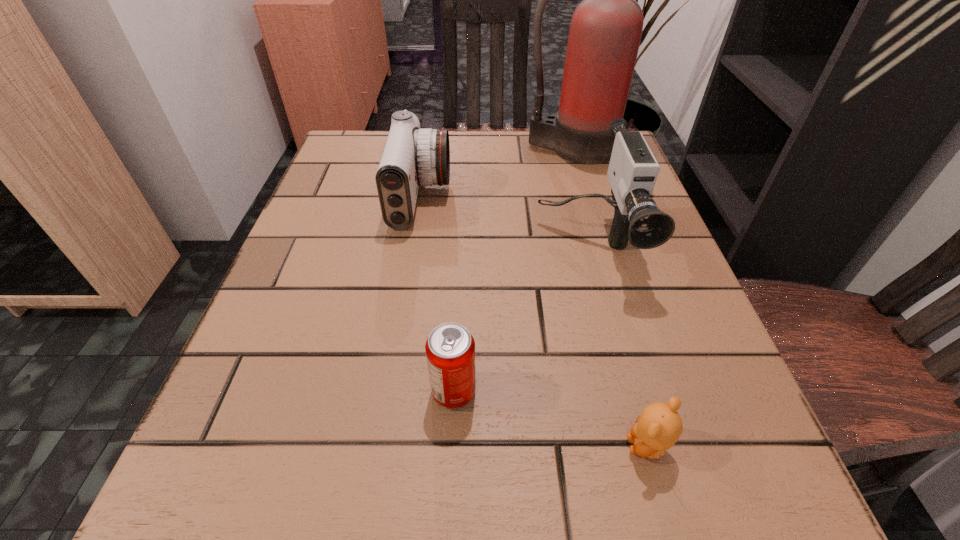
Identify the location of fire extinguisher present at the right edge. The width and height of the screenshot is (960, 540). (605, 32).

Where is `camcorder located in the right edge section of the desktop`? camcorder located in the right edge section of the desktop is located at coordinates (633, 170).

The width and height of the screenshot is (960, 540). Find the location of `teddy bear positioned at the right edge`. teddy bear positioned at the right edge is located at coordinates (657, 429).

The image size is (960, 540). What are the coordinates of `object at the far right corner` in the screenshot? It's located at (605, 32).

Locate an element on the screen. object situated at the near right corner is located at coordinates (657, 429).

In the image, there is a desktop. Identify the location of free region at the far edge. (459, 173).

In the image, there is a desktop. Identify the location of vacant space at the near edge. (385, 536).

Locate an element on the screen. This screenshot has width=960, height=540. free location at the left edge is located at coordinates (368, 251).

I want to click on free location at the right edge of the desktop, so click(725, 417).

This screenshot has height=540, width=960. In the image, there is a desktop. In order to click on free space at the far left corner in this screenshot , I will do `click(335, 184)`.